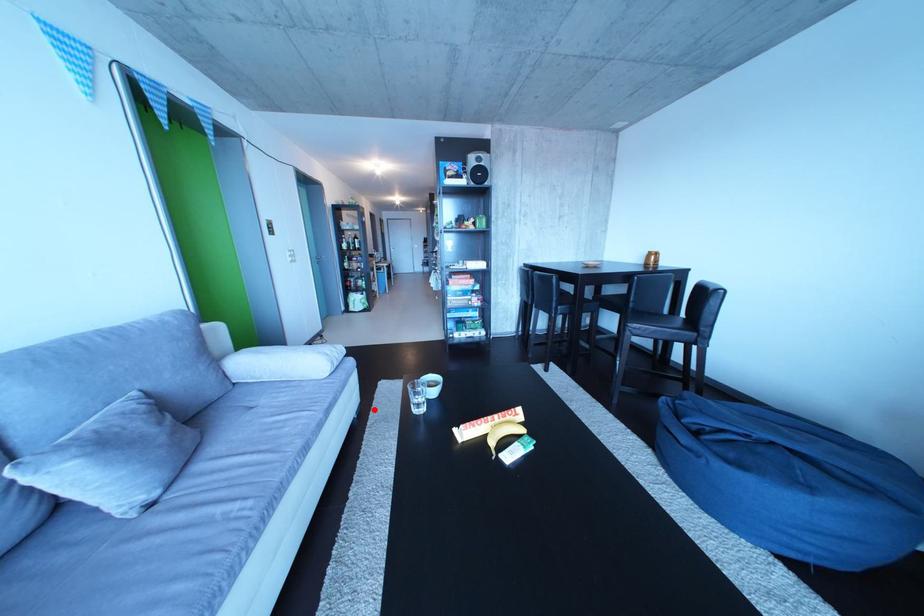
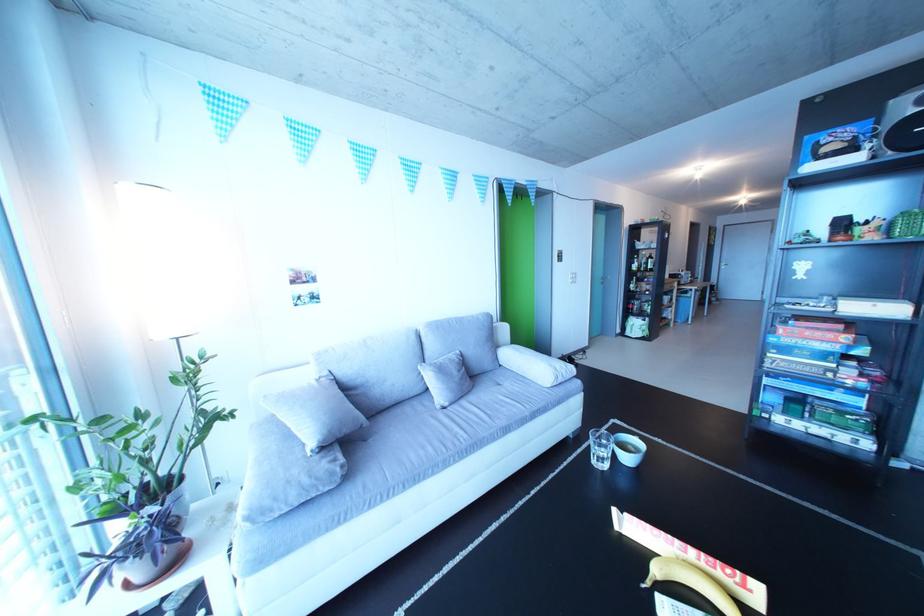
Find the pixel in the second image that matches the highlighted location in the first image.

(594, 435)